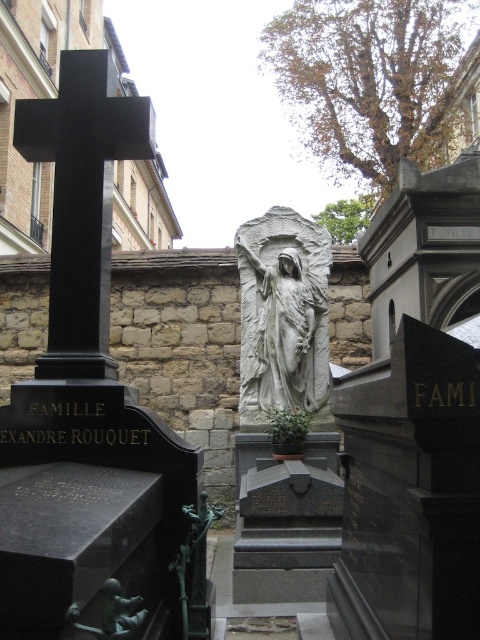
Question: Which point appears closest to the camera in this image?

Choices:
 (A) (104, 580)
 (B) (264, 420)

Answer: (A)

Question: Which of the following is the closest to the observer?

Choices:
 (A) (273, 264)
 (B) (105, 582)

Answer: (B)

Question: Which object is closer to the camera taking this photo?

Choices:
 (A) black polished stone cross at upper left
 (B) white stone statue at center

Answer: (A)

Question: Considering the relative positions of white stone statue at center and green patina statue at lower center in the image provided, where is white stone statue at center located with respect to green patina statue at lower center?

Choices:
 (A) above
 (B) below

Answer: (A)

Question: Is white stone statue at center wider than green patina statue at lower center?

Choices:
 (A) no
 (B) yes

Answer: (B)

Question: Can you confirm if white stone statue at center is positioned to the right of green patina statue at lower center?

Choices:
 (A) no
 (B) yes

Answer: (B)